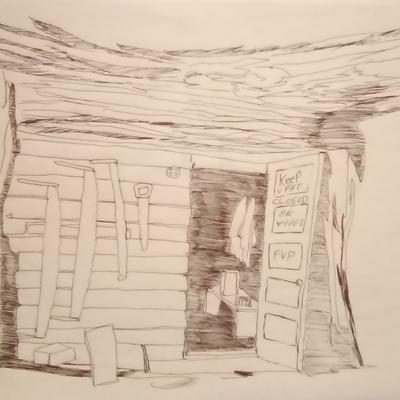
At what (x,y) coordinates should I click in order to perform the action: click on door. Please return your answer as a coordinate pair (x, y). Looking at the image, I should click on (289, 274).